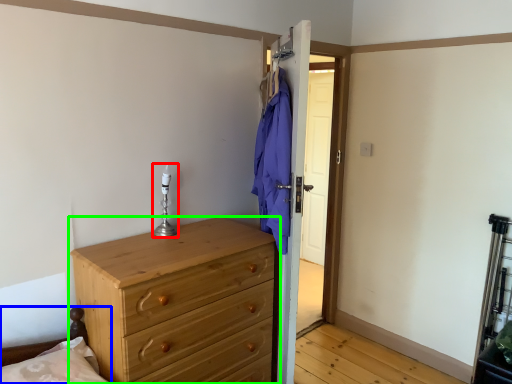
Question: Which object is positioned farthest from candle holder (highlighted by a red box)? Select from bed frame (highlighted by a blue box) and chest of drawers (highlighted by a green box).

Choices:
 (A) bed frame
 (B) chest of drawers

Answer: (A)